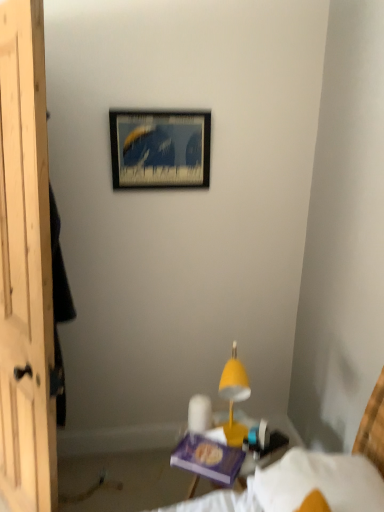
Question: Is wooden picture frame at upper center wider than yellow matte table lamp at center?

Choices:
 (A) no
 (B) yes

Answer: (A)

Question: Is wooden picture frame at upper center positioned in front of yellow matte table lamp at center?

Choices:
 (A) no
 (B) yes

Answer: (A)

Question: Can you confirm if wooden picture frame at upper center is taller than yellow matte table lamp at center?

Choices:
 (A) yes
 (B) no

Answer: (B)

Question: Considering the relative sizes of wooden picture frame at upper center and yellow matte table lamp at center in the image provided, is wooden picture frame at upper center thinner than yellow matte table lamp at center?

Choices:
 (A) yes
 (B) no

Answer: (A)

Question: Is wooden picture frame at upper center smaller than yellow matte table lamp at center?

Choices:
 (A) no
 (B) yes

Answer: (B)

Question: Is white fabric bed at lower right taller or shorter than wooden picture frame at upper center?

Choices:
 (A) short
 (B) tall

Answer: (B)

Question: Looking at the image, does white fabric bed at lower right seem bigger or smaller compared to wooden picture frame at upper center?

Choices:
 (A) small
 (B) big

Answer: (B)

Question: From a real-world perspective, is white fabric bed at lower right physically located above or below wooden picture frame at upper center?

Choices:
 (A) below
 (B) above

Answer: (A)

Question: Is white fabric bed at lower right wider or thinner than wooden picture frame at upper center?

Choices:
 (A) wide
 (B) thin

Answer: (A)

Question: From the image's perspective, is wooden picture frame at upper center located above or below yellow matte table lamp at center?

Choices:
 (A) above
 (B) below

Answer: (A)

Question: From their relative heights in the image, would you say wooden picture frame at upper center is taller or shorter than yellow matte table lamp at center?

Choices:
 (A) short
 (B) tall

Answer: (A)

Question: From a real-world perspective, is wooden picture frame at upper center above or below yellow matte table lamp at center?

Choices:
 (A) below
 (B) above

Answer: (B)

Question: In terms of width, does wooden picture frame at upper center look wider or thinner when compared to yellow matte table lamp at center?

Choices:
 (A) thin
 (B) wide

Answer: (A)

Question: In the image, is wooden picture frame at upper center positioned in front of or behind white fabric bed at lower right?

Choices:
 (A) behind
 (B) front

Answer: (A)

Question: Is wooden picture frame at upper center to the left or to the right of white fabric bed at lower right in the image?

Choices:
 (A) right
 (B) left

Answer: (B)